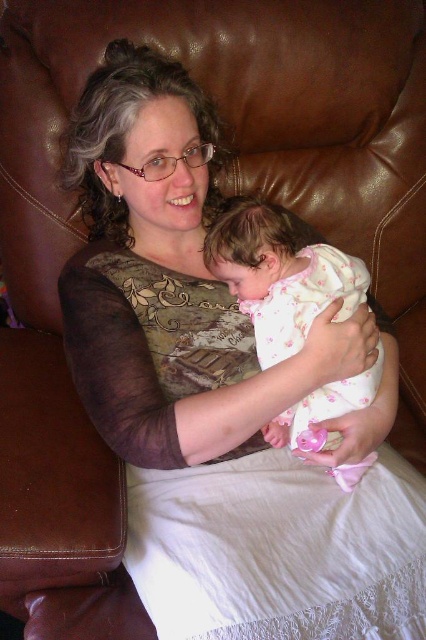
Question: Does matte brown dress at center appear over white floral fabric baby at center?

Choices:
 (A) no
 (B) yes

Answer: (B)

Question: Which of the following is the closest to the observer?

Choices:
 (A) (314, 406)
 (B) (180, 237)

Answer: (A)

Question: Which of the following is the farthest from the observer?

Choices:
 (A) (175, 145)
 (B) (363, 468)

Answer: (B)

Question: Is matte brown dress at center positioned at the back of white floral fabric baby at center?

Choices:
 (A) yes
 (B) no

Answer: (B)

Question: Does matte brown dress at center appear under white floral fabric baby at center?

Choices:
 (A) no
 (B) yes

Answer: (A)